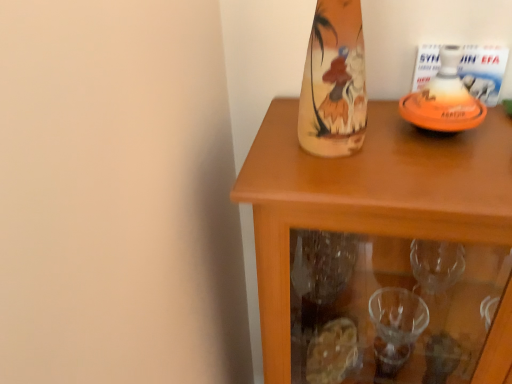
This screenshot has height=384, width=512. Identify the location of free region on the left part of orange matte bottle at upper right. (340, 149).